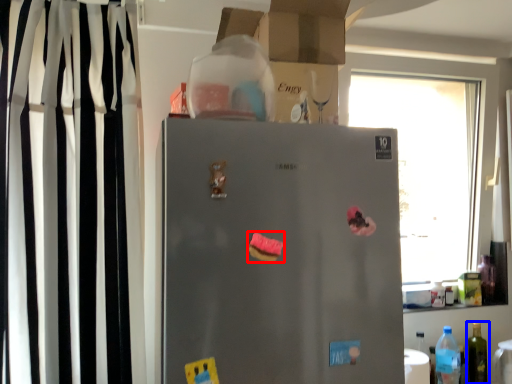
Question: Which object is closer to the camera taking this photo, stuff (highlighted by a red box) or bottle (highlighted by a blue box)?

Choices:
 (A) stuff
 (B) bottle

Answer: (A)